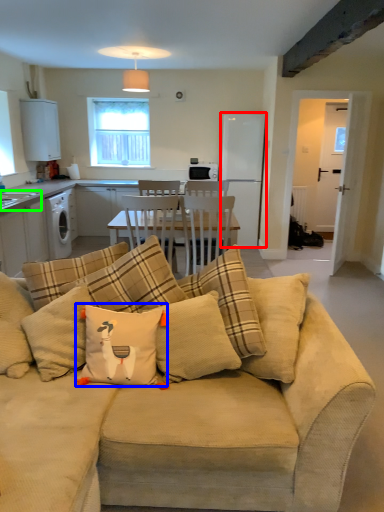
Question: Which object is positioned farthest from appliance (highlighted by a red box)? Select from throw pillow (highlighted by a blue box) and sink (highlighted by a green box).

Choices:
 (A) throw pillow
 (B) sink

Answer: (A)